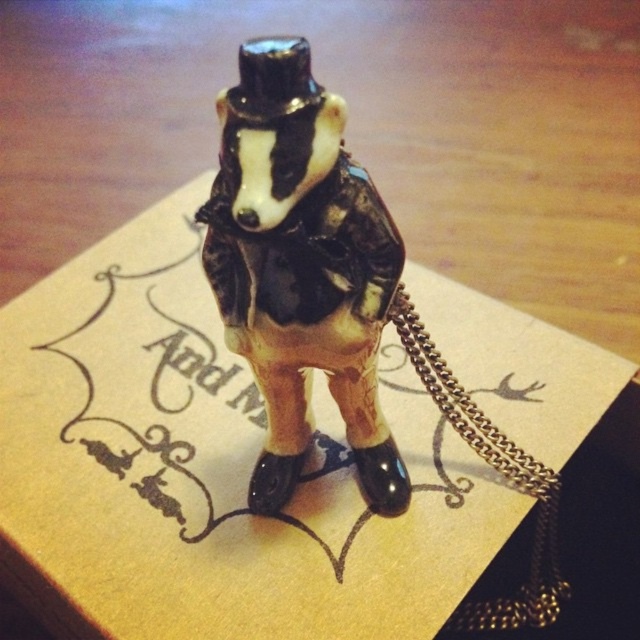
Question: Does porcelain badger at center appear over gold chain at lower right?

Choices:
 (A) yes
 (B) no

Answer: (A)

Question: Does porcelain badger at center have a greater width compared to gold chain at lower right?

Choices:
 (A) yes
 (B) no

Answer: (B)

Question: Which point appears closest to the camera in this image?

Choices:
 (A) (506, 596)
 (B) (276, 298)

Answer: (B)

Question: Which point is closer to the camera?

Choices:
 (A) porcelain badger at center
 (B) gold chain at lower right

Answer: (A)

Question: Which point is farther to the camera?

Choices:
 (A) (531, 563)
 (B) (358, 410)

Answer: (A)

Question: Is porcelain badger at center wider than gold chain at lower right?

Choices:
 (A) yes
 (B) no

Answer: (B)